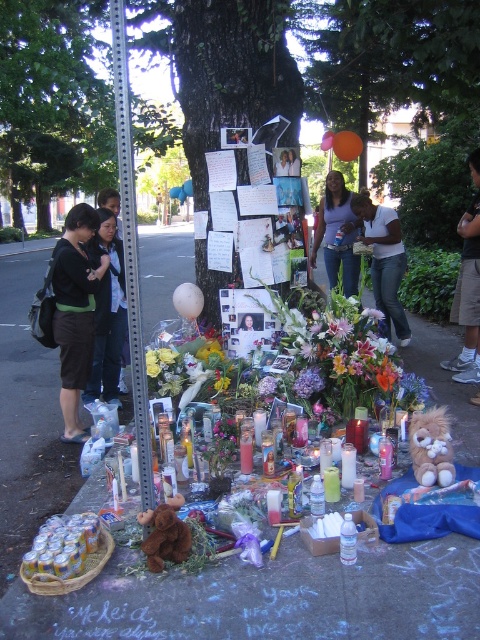
You are a maintenance worker who needs to place a 6 feet long caution tape between the smooth concrete sidewalk at center and the purple fabric flower at center. Can you fit the tape between them without overlapping either object?

The distance between the smooth concrete sidewalk at center and the purple fabric flower at center is 5.50 feet. Since the caution tape is 6 feet long, it would be 0.5 feet longer than the space available. Therefore, the tape cannot be placed between them without overlapping either object.

You are standing in front of the memorial setup. There is a purple matte flower at center and a smooth skin face at center. Which object is positioned to the right side?

The smooth skin face at center is positioned to the right of the purple matte flower at center.

You are a delivery person with a cart that is 2 meters wide. You need to pass through the area between the smooth concrete sidewalk at center and the purple matte flower at center. Can your cart fit through the space between them?

The smooth concrete sidewalk at center and purple matte flower at center are 2.29 meters apart, so yes, the cart can fit through the space between them since the distance is greater than the cart width.